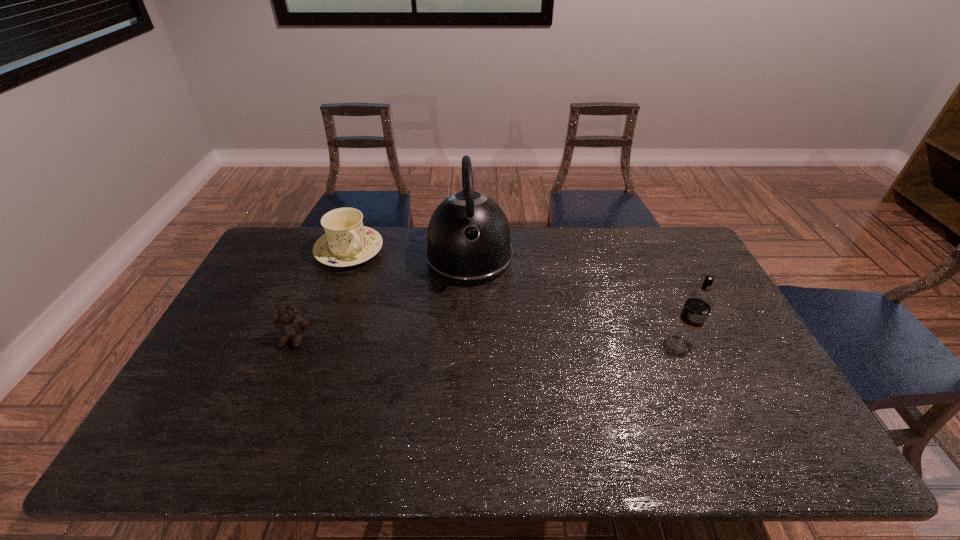
Where is `free space between the tallest object and the vodka`? The height and width of the screenshot is (540, 960). free space between the tallest object and the vodka is located at coordinates (576, 299).

Where is `unoccupied area between the teddy bear and the tallest object`? The width and height of the screenshot is (960, 540). unoccupied area between the teddy bear and the tallest object is located at coordinates (382, 298).

Where is `free area in between the vodka and the tallest object`? The image size is (960, 540). free area in between the vodka and the tallest object is located at coordinates (576, 299).

The width and height of the screenshot is (960, 540). In order to click on free point between the teddy bear and the second tallest object in this screenshot , I will do `click(489, 340)`.

Where is `free space between the kettle and the chinaware`? free space between the kettle and the chinaware is located at coordinates (409, 254).

Choose which object is the third nearest neighbor to the tallest object. Please provide its 2D coordinates. Your answer should be formatted as a tuple, i.e. [(x, y)], where the tuple contains the x and y coordinates of a point satisfying the conditions above.

[(699, 302)]

Locate an element on the screen. object that can be found as the closest to the vodka is located at coordinates (468, 243).

You are a GUI agent. You are given a task and a screenshot of the screen. Output one action in this format:
    pyautogui.click(x=<x>, y=<y>)
    Task: Click on the vacant position in the image that satisfies the following two spatial constraints: 1. on the front side of the second object from right to left; 2. on the left side of the chinaware
    
    Given the screenshot: What is the action you would take?
    pyautogui.click(x=347, y=258)

You are a GUI agent. You are given a task and a screenshot of the screen. Output one action in this format:
    pyautogui.click(x=<x>, y=<y>)
    Task: Click on the blank area in the image that satisfies the following two spatial constraints: 1. on the front side of the chinaware; 2. on the left side of the second object from right to left
    The height and width of the screenshot is (540, 960).
    Given the screenshot: What is the action you would take?
    pyautogui.click(x=347, y=258)